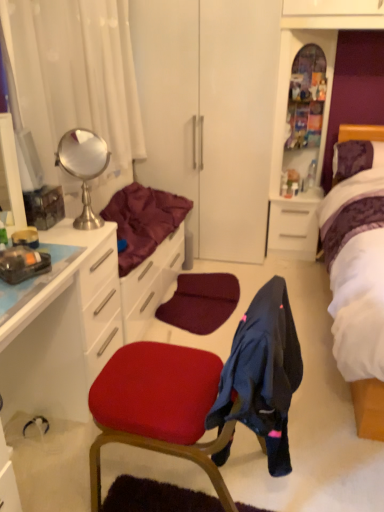
The height and width of the screenshot is (512, 384). What do you see at coordinates (76, 75) in the screenshot?
I see `white fabric curtain at left` at bounding box center [76, 75].

What do you see at coordinates (262, 374) in the screenshot? I see `dark blue fabric at center` at bounding box center [262, 374].

This screenshot has height=512, width=384. What are the coordinates of `matte red chair at center` in the screenshot? It's located at (203, 394).

Where is `translucent glass cabinet at upper center, placed as the 1th file cabinet when sorted from top to bottom`? translucent glass cabinet at upper center, placed as the 1th file cabinet when sorted from top to bottom is located at coordinates (297, 152).

What do you see at coordinates (297, 152) in the screenshot? This screenshot has width=384, height=512. I see `translucent glass cabinet at upper center, positioned as the second file cabinet in bottom-to-top order` at bounding box center [297, 152].

The width and height of the screenshot is (384, 512). What do you see at coordinates (64, 330) in the screenshot? I see `white glossy cabinet at left` at bounding box center [64, 330].

At what (x,y) coordinates should I click in order to perform the action: click on white fabric curtain at left. Please return your answer as a coordinate pair (x, y). The height and width of the screenshot is (512, 384). Looking at the image, I should click on (76, 75).

From the image's perspective, which is below, maroon fabric at left or dark blue fabric at center?

dark blue fabric at center, from the image's perspective.

You are a GUI agent. You are given a task and a screenshot of the screen. Output one action in this format:
    pyautogui.click(x=<x>, y=<y>)
    Task: Click on the clothing in front of the maroon fabric at left
    The height and width of the screenshot is (512, 384).
    Given the screenshot: What is the action you would take?
    pyautogui.click(x=262, y=374)

Which is more to the right, maroon fabric at left or dark blue fabric at center?

Positioned to the right is dark blue fabric at center.

Based on the photo, does purple satin bed at right turn towards matte red chair at center?

No, purple satin bed at right does not turn towards matte red chair at center.

At what (x,y) coordinates should I click in order to perform the action: click on bed above the matte red chair at center (from a real-world perspective). Please return your answer as a coordinate pair (x, y). The width and height of the screenshot is (384, 512). Looking at the image, I should click on (369, 408).

Which of these two, purple satin bed at right or matte red chair at center, stands taller?

With more height is purple satin bed at right.

From the image's perspective, who appears lower, purple satin bed at right or matte red chair at center?

From the image's view, matte red chair at center is below.

From the image's perspective, is matte red chair at center over white glossy cabinet at left?

No.

Which object is further away from the camera, matte red chair at center or white glossy cabinet at left?

matte red chair at center is more distant.

Considering the positions of objects matte red chair at center and white glossy cabinet at left in the image provided, who is more to the right, matte red chair at center or white glossy cabinet at left?

matte red chair at center is more to the right.

Is point (274, 417) positioned in front of point (63, 282)?

Yes, point (274, 417) is in front of point (63, 282).

Which of these two, dark blue fabric at center or white glossy cabinet at left, stands taller?

With more height is white glossy cabinet at left.

From the image's perspective, does dark blue fabric at center appear higher than white glossy cabinet at left?

No, from the image's perspective, dark blue fabric at center is not over white glossy cabinet at left.

Identify the location of cabinetry that is behind the dark blue fabric at center. The height and width of the screenshot is (512, 384). (64, 330).

How different are the orientations of dark blue fabric at center and white glossy cabinet at left in degrees?

The angle between the facing direction of dark blue fabric at center and the facing direction of white glossy cabinet at left is 178 degrees.

Considering the relative positions of matte red chair at center and dark blue fabric at center in the image provided, is matte red chair at center to the left or to the right of dark blue fabric at center?

matte red chair at center is positioned on dark blue fabric at center's left side.

At what (x,y) coordinates should I click in order to perform the action: click on clothing located in front of the matte red chair at center. Please return your answer as a coordinate pair (x, y). The image size is (384, 512). Looking at the image, I should click on (262, 374).

From their relative heights in the image, would you say matte red chair at center is taller or shorter than dark blue fabric at center?

Clearly, matte red chair at center is taller compared to dark blue fabric at center.

Is matte red chair at center aimed at dark blue fabric at center?

Yes, matte red chair at center is oriented towards dark blue fabric at center.

Is polished silver mirror at upper left in front of or behind matte red chair at center in the image?

In the image, polished silver mirror at upper left appears behind matte red chair at center.

Who is smaller, polished silver mirror at upper left or matte red chair at center?

Smaller between the two is polished silver mirror at upper left.

Is point (69, 159) positioned before point (204, 362)?

No.

Can you confirm if polished silver mirror at upper left is smaller than translucent glass cabinet at upper center, positioned as the second file cabinet in bottom-to-top order?

Yes.

I want to click on the 1st file cabinet behind the polished silver mirror at upper left, starting your count from the anchor, so click(x=297, y=152).

Can you confirm if polished silver mirror at upper left is thinner than translucent glass cabinet at upper center, placed as the 1th file cabinet when sorted from top to bottom?

Correct, the width of polished silver mirror at upper left is less than that of translucent glass cabinet at upper center, placed as the 1th file cabinet when sorted from top to bottom.

Would you say polished silver mirror at upper left is outside translucent glass cabinet at upper center, positioned as the second file cabinet in bottom-to-top order?

Yes, polished silver mirror at upper left is outside of translucent glass cabinet at upper center, positioned as the second file cabinet in bottom-to-top order.

Find the location of a particular element. The image size is (384, 512). bedding above the dark blue fabric at center (from the image's perspective) is located at coordinates (143, 221).

Where is `chair that is on the left side of purple satin bed at right`? Image resolution: width=384 pixels, height=512 pixels. chair that is on the left side of purple satin bed at right is located at coordinates 203,394.

Which object lies nearer to the anchor point white fabric curtain at left, translucent glass cabinet at upper center, positioned as the second file cabinet in bottom-to-top order, or white glossy cabinet at left?

The object closer to white fabric curtain at left is white glossy cabinet at left.

In the scene shown: Considering their positions, is dark blue fabric at center positioned closer to polished silver mirror at upper left than white glossy cabinet at left?

Based on the image, white glossy cabinet at left appears to be nearer to polished silver mirror at upper left.

Based on their spatial positions, is maroon fabric at left or white glossy cabinet at left closer to white glossy file cabinet at center right, the 2th file cabinet when ordered from top to bottom?

The object closer to white glossy file cabinet at center right, the 2th file cabinet when ordered from top to bottom, is maroon fabric at left.

When comparing their distances from purple satin bed at right, does matte red chair at center or dark blue fabric at center seem further?

matte red chair at center.

Based on their spatial positions, is translucent glass cabinet at upper center, positioned as the second file cabinet in bottom-to-top order, or purple velvet pillow at upper right further from white glossy cabinet at left?

purple velvet pillow at upper right.

When comparing their distances from polished silver mirror at upper left, does white glossy file cabinet at center right, the 1th file cabinet from the bottom, or purple satin bed at right seem further?

Among the two, purple satin bed at right is located further to polished silver mirror at upper left.

Looking at the image, which one is located further to white fabric curtain at left, white glossy file cabinet at center right, the 1th file cabinet from the bottom, or dark blue fabric at center?

dark blue fabric at center is positioned further to the anchor white fabric curtain at left.

Looking at the image, which one is located further to purple velvet pillow at upper right, maroon fabric at left or translucent glass cabinet at upper center, placed as the 1th file cabinet when sorted from top to bottom?

maroon fabric at left is positioned further to the anchor purple velvet pillow at upper right.

Find the location of a particular element. pillow between matte red chair at center and white glossy file cabinet at center right, the 1th file cabinet from the bottom, along the z-axis is located at coordinates (351, 158).

At what (x,y) coordinates should I click in order to perform the action: click on clothing between matte red chair at center and purple satin bed at right in the horizontal direction. Please return your answer as a coordinate pair (x, y). The width and height of the screenshot is (384, 512). Looking at the image, I should click on (262, 374).

Where is `curtain located between white glossy cabinet at left and purple satin bed at right in the left-right direction`? curtain located between white glossy cabinet at left and purple satin bed at right in the left-right direction is located at coordinates (76, 75).

Image resolution: width=384 pixels, height=512 pixels. Identify the location of bed located between dark blue fabric at center and white glossy file cabinet at center right, the 1th file cabinet from the bottom, in the depth direction. (369, 408).